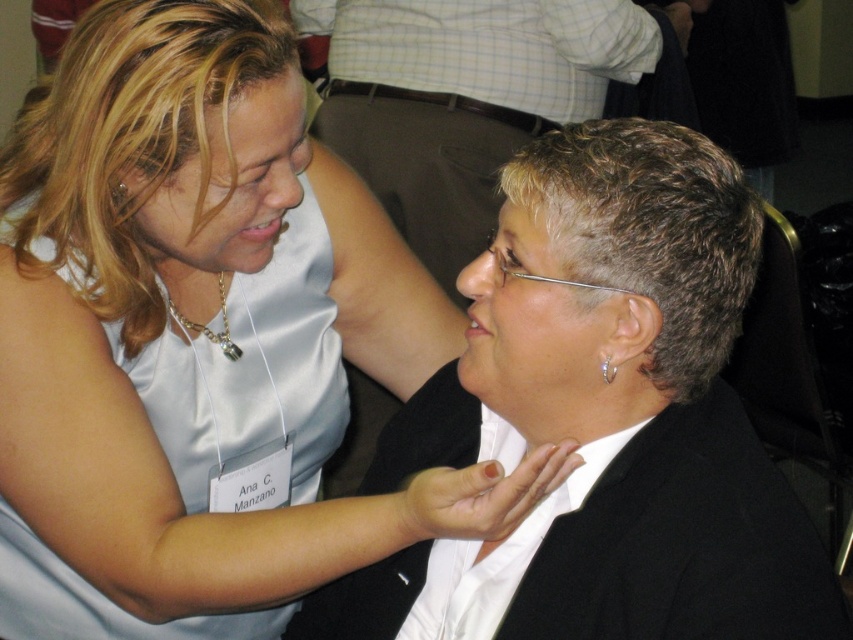
Question: Based on their relative distances, which object is farther from the silver metallic earring at right ear?

Choices:
 (A) white glossy shirt at center
 (B) gray matte hair at center
 (C) white satin dress at upper left
 (D) satin white dress at upper left

Answer: (B)

Question: Can you confirm if white glossy shirt at center is positioned above gray matte hair at center?

Choices:
 (A) no
 (B) yes

Answer: (A)

Question: Which of the following is the closest to the observer?

Choices:
 (A) silver metallic earring at right ear
 (B) gray matte hair at center
 (C) white glossy shirt at center
 (D) white satin dress at upper left

Answer: (D)

Question: Does gray matte hair at center lie in front of silver metallic earring at right ear?

Choices:
 (A) yes
 (B) no

Answer: (B)

Question: Can you confirm if gray matte hair at center is positioned below silver metallic earring at right ear?

Choices:
 (A) no
 (B) yes

Answer: (A)

Question: Which point appears closest to the camera in this image?

Choices:
 (A) (610, 362)
 (B) (107, 352)

Answer: (A)